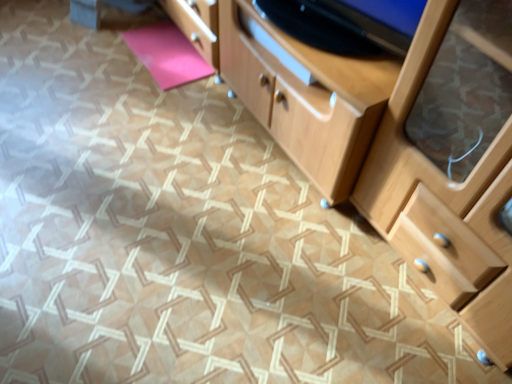
Identify the location of pink matte yoga mat at upper left. This screenshot has height=384, width=512. (167, 54).

The width and height of the screenshot is (512, 384). What do you see at coordinates (167, 54) in the screenshot?
I see `pink matte yoga mat at upper left` at bounding box center [167, 54].

Where is `light wood chest of drawers at center`? This screenshot has height=384, width=512. light wood chest of drawers at center is located at coordinates (377, 150).

This screenshot has width=512, height=384. What do you see at coordinates (377, 150) in the screenshot? I see `light wood chest of drawers at center` at bounding box center [377, 150].

Find the location of a particular element. Image resolution: width=512 pixels, height=384 pixels. pink matte yoga mat at upper left is located at coordinates click(x=167, y=54).

Considering the relative positions of pink matte yoga mat at upper left and light wood chest of drawers at center in the image provided, is pink matte yoga mat at upper left to the left of light wood chest of drawers at center from the viewer's perspective?

Correct, you'll find pink matte yoga mat at upper left to the left of light wood chest of drawers at center.

Considering the positions of objects pink matte yoga mat at upper left and light wood chest of drawers at center in the image provided, who is behind, pink matte yoga mat at upper left or light wood chest of drawers at center?

pink matte yoga mat at upper left.

Is point (154, 57) more distant than point (273, 37)?

Yes.

From the image's perspective, is pink matte yoga mat at upper left located above or below light wood chest of drawers at center?

Based on their image positions, pink matte yoga mat at upper left is located above light wood chest of drawers at center.

From a real-world perspective, between pink matte yoga mat at upper left and light wood chest of drawers at center, who is vertically higher?

From a 3D spatial view, light wood chest of drawers at center is above.

Is pink matte yoga mat at upper left wider or thinner than light wood chest of drawers at center?

In the image, pink matte yoga mat at upper left appears to be more narrow than light wood chest of drawers at center.

Considering the relative sizes of pink matte yoga mat at upper left and light wood chest of drawers at center in the image provided, is pink matte yoga mat at upper left shorter than light wood chest of drawers at center?

Indeed, pink matte yoga mat at upper left has a lesser height compared to light wood chest of drawers at center.

Can you confirm if pink matte yoga mat at upper left is smaller than light wood chest of drawers at center?

Yes.

Is pink matte yoga mat at upper left not inside light wood chest of drawers at center?

That's incorrect, pink matte yoga mat at upper left is not completely outside light wood chest of drawers at center.

Is pink matte yoga mat at upper left next to light wood chest of drawers at center and touching it?

No, pink matte yoga mat at upper left is not beside light wood chest of drawers at center.

Is pink matte yoga mat at upper left positioned with its back to light wood chest of drawers at center?

Yes, pink matte yoga mat at upper left is positioned with its back facing light wood chest of drawers at center.

How different are the orientations of pink matte yoga mat at upper left and light wood chest of drawers at center in degrees?

The angular difference between pink matte yoga mat at upper left and light wood chest of drawers at center is 0.000173 degrees.

Measure the distance from pink matte yoga mat at upper left to light wood chest of drawers at center.

The distance of pink matte yoga mat at upper left from light wood chest of drawers at center is 29.30 inches.

Locate an element on the screen. The width and height of the screenshot is (512, 384). yoga mat behind the light wood chest of drawers at center is located at coordinates (167, 54).

From the picture: Is light wood chest of drawers at center at the right side of pink matte yoga mat at upper left?

Yes.

Who is more distant, light wood chest of drawers at center or pink matte yoga mat at upper left?

pink matte yoga mat at upper left is behind.

Is point (315, 169) closer to viewer compared to point (153, 45)?

That is True.

From the image's perspective, is light wood chest of drawers at center positioned above or below pink matte yoga mat at upper left?

From the image's perspective, light wood chest of drawers at center appears below pink matte yoga mat at upper left.

From a real-world perspective, who is located higher, light wood chest of drawers at center or pink matte yoga mat at upper left?

light wood chest of drawers at center is physically above.

Between light wood chest of drawers at center and pink matte yoga mat at upper left, which one has smaller width?

With smaller width is pink matte yoga mat at upper left.

Consider the image. Who is taller, light wood chest of drawers at center or pink matte yoga mat at upper left?

light wood chest of drawers at center is taller.

Considering the sizes of light wood chest of drawers at center and pink matte yoga mat at upper left in the image, is light wood chest of drawers at center bigger or smaller than pink matte yoga mat at upper left?

Clearly, light wood chest of drawers at center is larger in size than pink matte yoga mat at upper left.

Is light wood chest of drawers at center spatially inside pink matte yoga mat at upper left, or outside of it?

light wood chest of drawers at center lies outside pink matte yoga mat at upper left.

Would you say light wood chest of drawers at center is a long distance from pink matte yoga mat at upper left?

Actually, light wood chest of drawers at center and pink matte yoga mat at upper left are a little close together.

Is pink matte yoga mat at upper left at the back of light wood chest of drawers at center?

That's not correct — light wood chest of drawers at center is not looking away from pink matte yoga mat at upper left.

Where is `the chest of drawers located in front of the pink matte yoga mat at upper left`? the chest of drawers located in front of the pink matte yoga mat at upper left is located at coordinates (377, 150).

Identify the location of chest of drawers above the pink matte yoga mat at upper left (from a real-world perspective). Image resolution: width=512 pixels, height=384 pixels. (377, 150).

The image size is (512, 384). Find the location of `yoga mat lying above the light wood chest of drawers at center (from the image's perspective)`. yoga mat lying above the light wood chest of drawers at center (from the image's perspective) is located at coordinates 167,54.